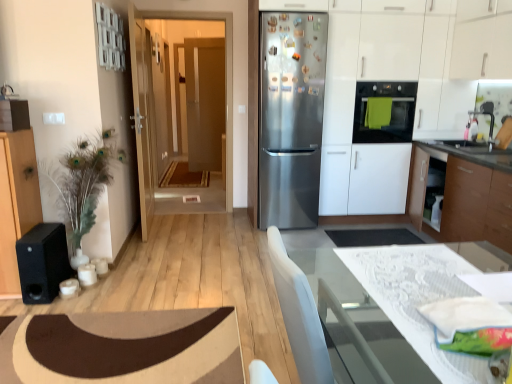
Question: Does wooden door at center, placed as the 2th door when sorted from back to front, come behind white glossy countertop at lower right?

Choices:
 (A) no
 (B) yes

Answer: (A)

Question: Can you confirm if wooden door at center, placed as the 2th door when sorted from back to front, is bigger than white glossy countertop at lower right?

Choices:
 (A) no
 (B) yes

Answer: (B)

Question: Considering the relative positions of wooden door at center, placed as the 2th door when sorted from back to front, and white glossy countertop at lower right in the image provided, is wooden door at center, placed as the 2th door when sorted from back to front, to the left of white glossy countertop at lower right from the viewer's perspective?

Choices:
 (A) no
 (B) yes

Answer: (B)

Question: Can you confirm if wooden door at center, placed as the 2th door when sorted from back to front, is smaller than white glossy countertop at lower right?

Choices:
 (A) no
 (B) yes

Answer: (A)

Question: From a real-world perspective, is wooden door at center, marked as the first door in a front-to-back arrangement, located higher than white glossy countertop at lower right?

Choices:
 (A) yes
 (B) no

Answer: (A)

Question: Is wooden door at center, marked as the first door in a front-to-back arrangement, beside white glossy countertop at lower right?

Choices:
 (A) no
 (B) yes

Answer: (A)

Question: Is wooden door at center, placed as the 2th door when sorted from back to front, facing away from matte wooden door at center, marked as the first door in a back-to-front arrangement?

Choices:
 (A) yes
 (B) no

Answer: (B)

Question: From the image's perspective, would you say wooden door at center, marked as the first door in a front-to-back arrangement, is positioned over matte wooden door at center, marked as the first door in a back-to-front arrangement?

Choices:
 (A) yes
 (B) no

Answer: (B)

Question: Is wooden door at center, placed as the 2th door when sorted from back to front, positioned behind matte wooden door at center, marked as the first door in a back-to-front arrangement?

Choices:
 (A) no
 (B) yes

Answer: (A)

Question: Would you say wooden door at center, placed as the 2th door when sorted from back to front, contains matte wooden door at center, acting as the 2th door starting from the front?

Choices:
 (A) yes
 (B) no

Answer: (B)

Question: Is wooden door at center, marked as the first door in a front-to-back arrangement, located outside matte wooden door at center, marked as the first door in a back-to-front arrangement?

Choices:
 (A) yes
 (B) no

Answer: (A)

Question: Is wooden door at center, placed as the 2th door when sorted from back to front, in contact with matte wooden door at center, marked as the first door in a back-to-front arrangement?

Choices:
 (A) yes
 (B) no

Answer: (B)

Question: Considering the relative sizes of black matte speaker at left and satin white cabinet at right in the image provided, is black matte speaker at left thinner than satin white cabinet at right?

Choices:
 (A) yes
 (B) no

Answer: (A)